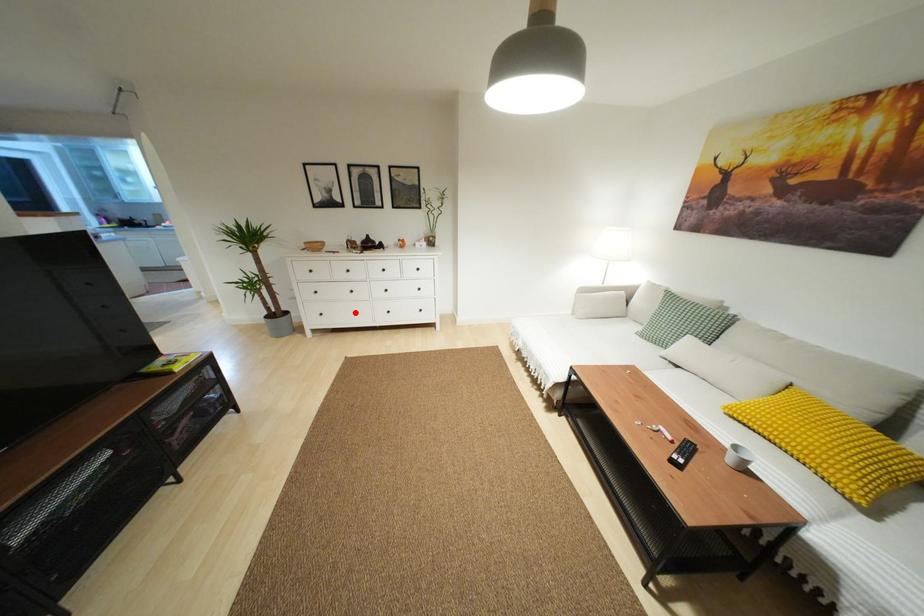
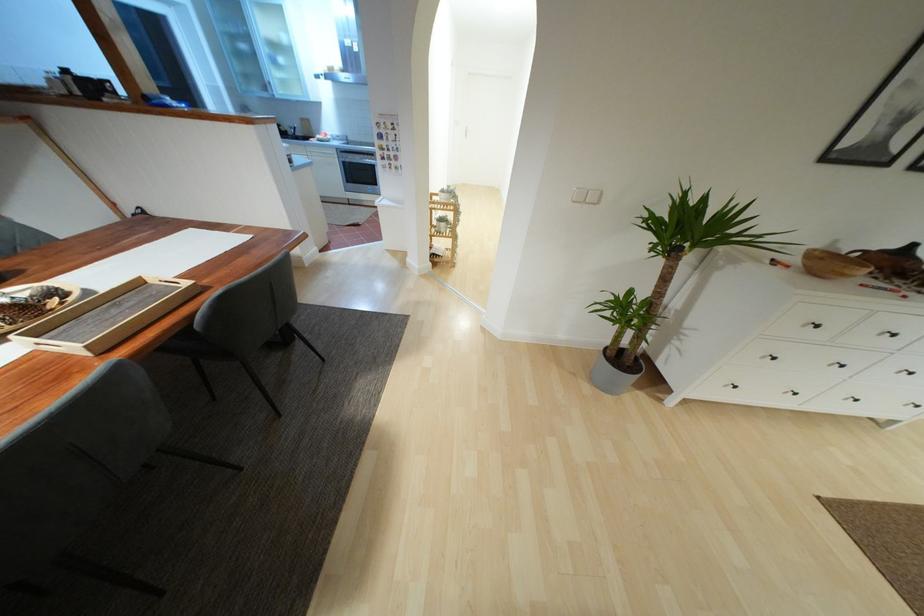
The point at the highlighted location is marked in the first image. Where is the corresponding point in the second image?

(795, 394)